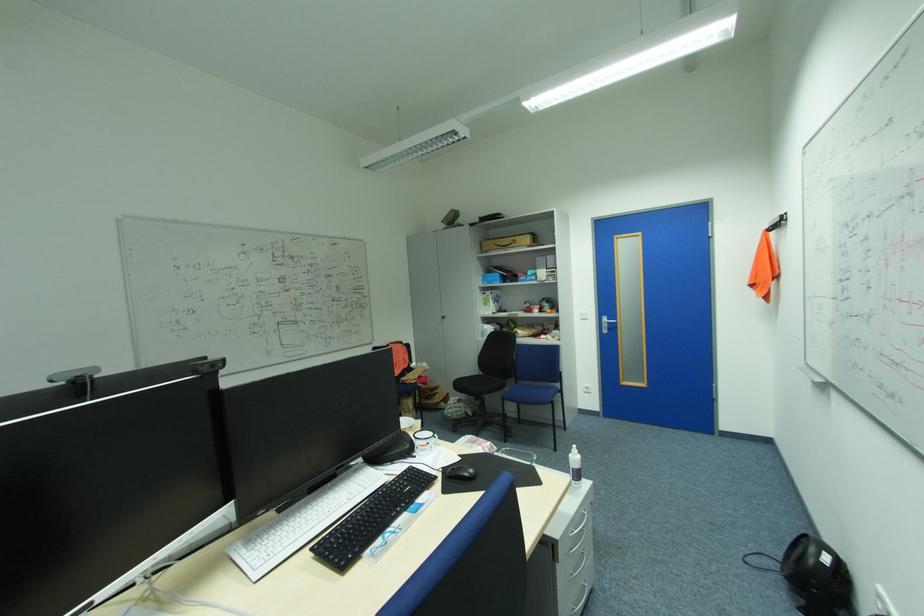
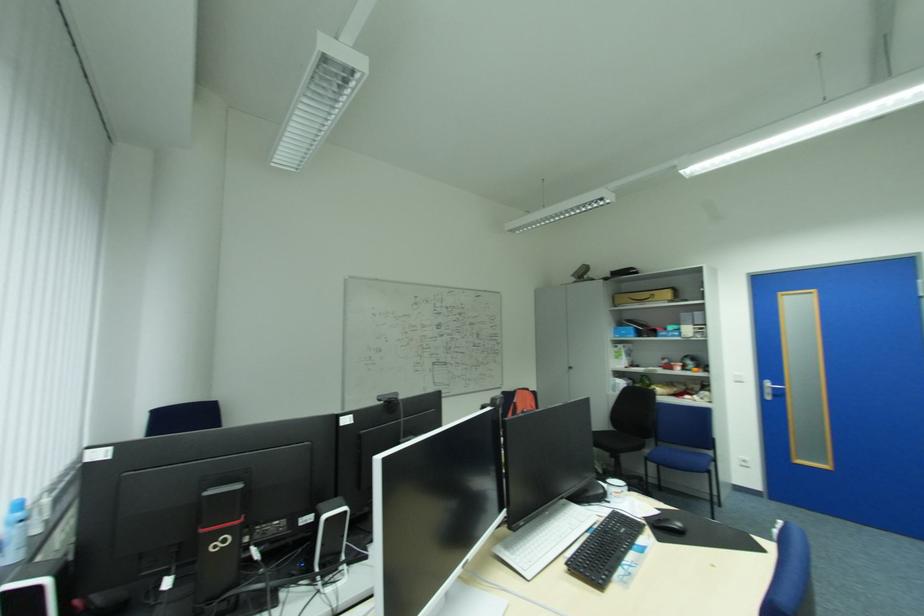
Find the pixel in the second image that matches point (446, 474) in the first image.

(652, 524)